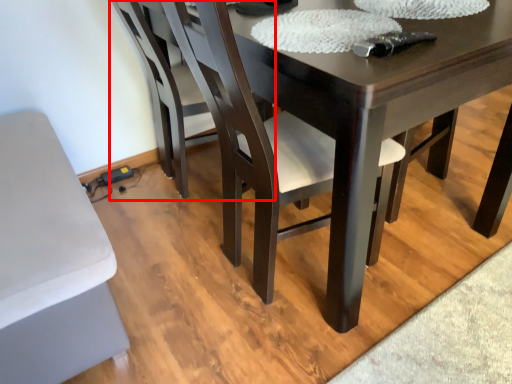
Question: Observing the image, what is the correct spatial positioning of chair (annotated by the red box) in reference to chair?

Choices:
 (A) left
 (B) right

Answer: (A)